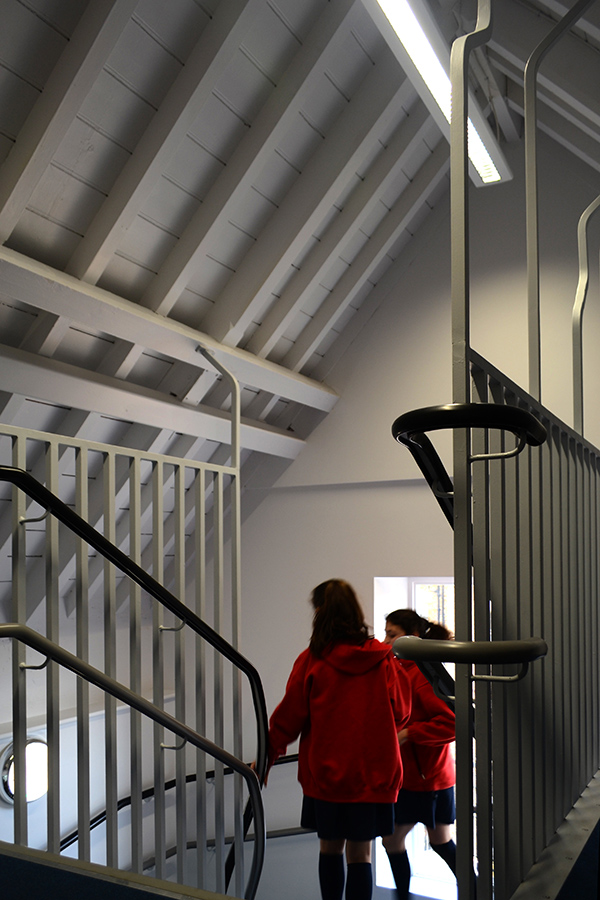
At what (x,y) coordinates should I click in order to perform the action: click on sock. Please return your answer as a coordinate pair (x, y). The image size is (600, 900). Looking at the image, I should click on (404, 867).